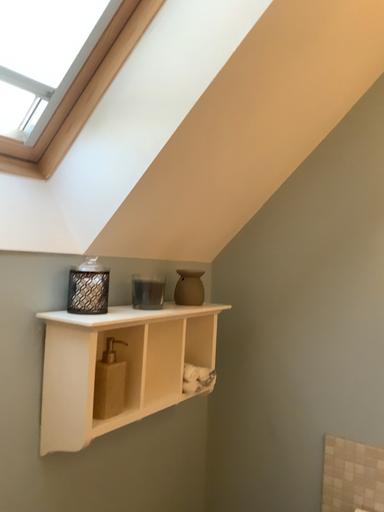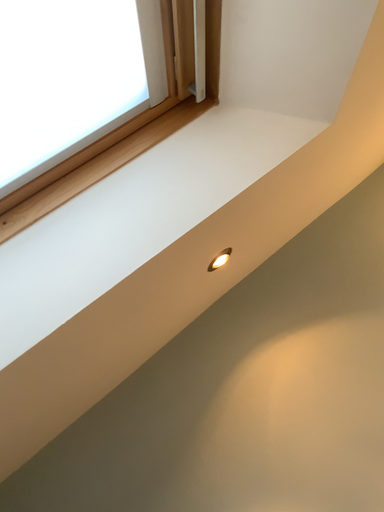
Question: Which way did the camera rotate in the video?

Choices:
 (A) rotated upward
 (B) rotated downward

Answer: (A)